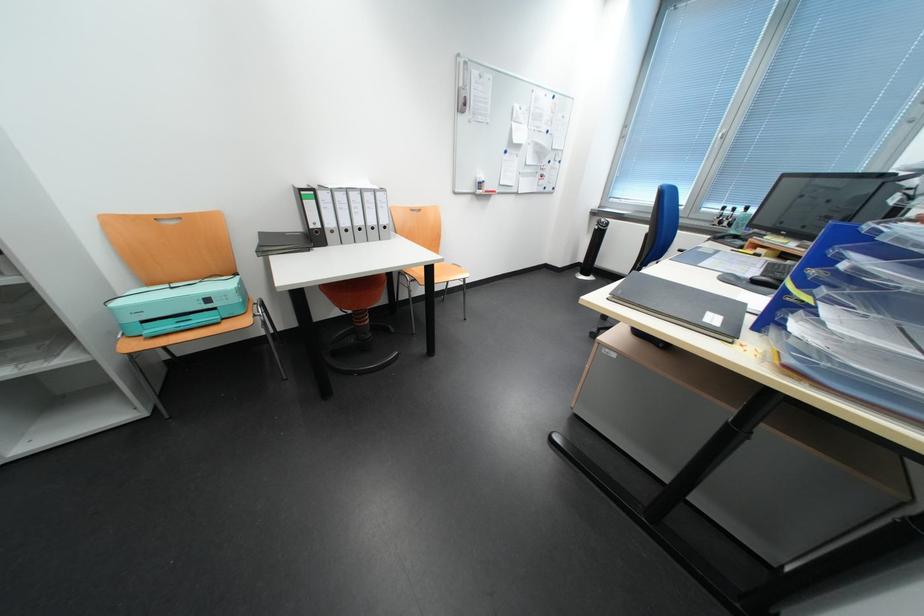
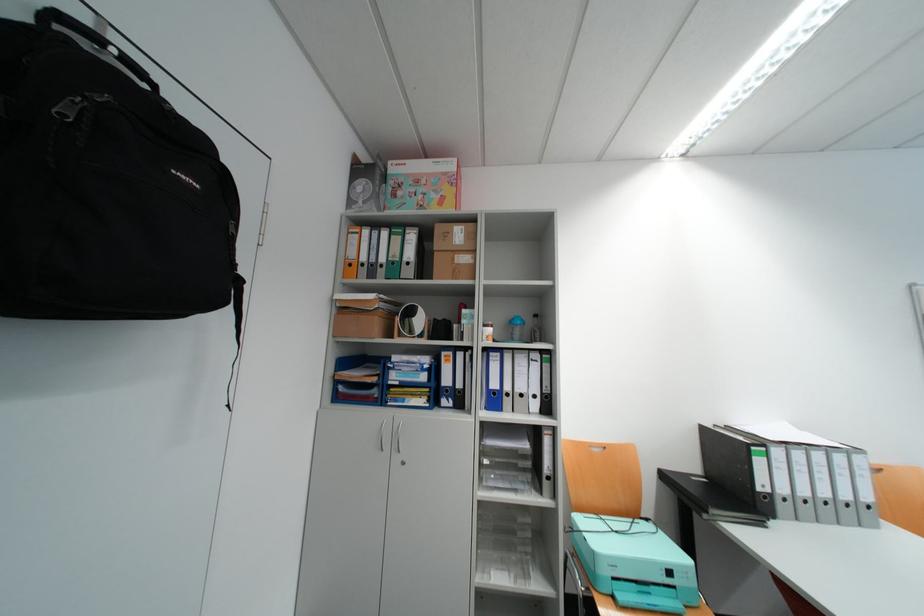
In the second image, find the point that corresponds to (x=220, y=302) in the first image.

(682, 573)